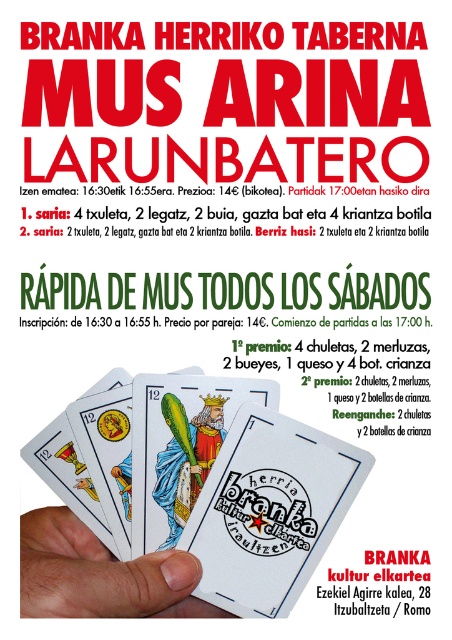
Question: Which of the following is the farthest from the observer?

Choices:
 (A) matte plastic playing card at center
 (B) white paper card at center

Answer: (B)

Question: Is white paper card at center further to the viewer compared to white paper cards at center?

Choices:
 (A) yes
 (B) no

Answer: (A)

Question: Which of the following is the farthest from the observer?

Choices:
 (A) (215, 604)
 (B) (202, 480)
 (C) (226, 460)
 (D) (95, 540)

Answer: (D)

Question: Does matte plastic cards at center have a smaller size compared to matte plastic playing card at center?

Choices:
 (A) yes
 (B) no

Answer: (B)

Question: Which point is closer to the camera?

Choices:
 (A) (183, 460)
 (B) (192, 444)
 (C) (276, 419)

Answer: (C)

Question: Is white paper cards at center further to the viewer compared to matte blue king at center?

Choices:
 (A) yes
 (B) no

Answer: (B)